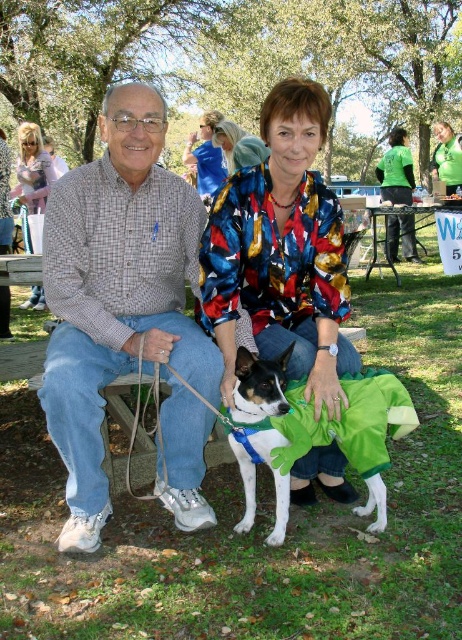
Does blonde hair at upper left have a greater height compared to black metal picnic table at center?

Indeed, blonde hair at upper left has a greater height compared to black metal picnic table at center.

Does blonde hair at upper left appear over black metal picnic table at center?

Yes.

Does point (25, 141) come closer to viewer compared to point (371, 256)?

Yes, it is.

The width and height of the screenshot is (462, 640). Identify the location of blonde hair at upper left. (32, 168).

Who is higher up, green fabric dog at center or black metal picnic table at center?

black metal picnic table at center is above.

Is green fabric dog at center below black metal picnic table at center?

Correct, green fabric dog at center is located below black metal picnic table at center.

Is point (363, 513) positioned after point (387, 262)?

No, (363, 513) is closer to viewer.

Find the location of a particular element. The width and height of the screenshot is (462, 640). green fabric dog at center is located at coordinates (260, 433).

Can you confirm if blonde hair at upper left is wider than green fabric shirt at upper right?

Correct, the width of blonde hair at upper left exceeds that of green fabric shirt at upper right.

Looking at this image, is blonde hair at upper left bigger than green fabric shirt at upper right?

Yes.

Is point (32, 131) positioned after point (449, 164)?

No, it is in front of (449, 164).

Locate an element on the screen. blonde hair at upper left is located at coordinates (32, 168).